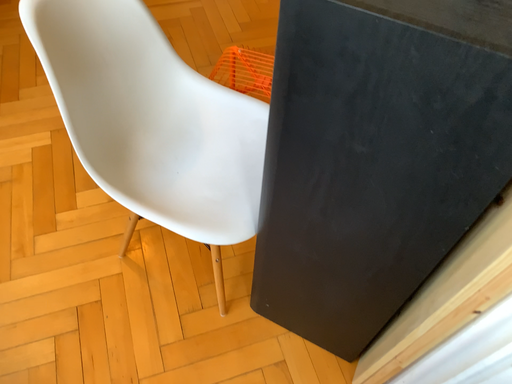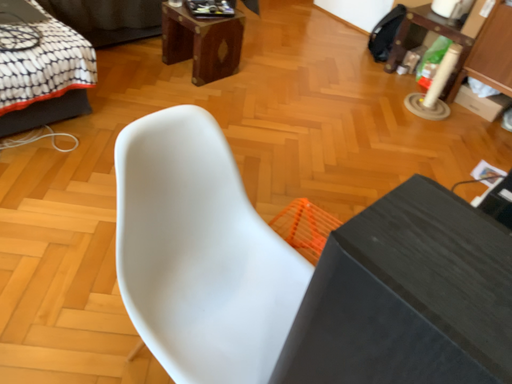
Question: Which way did the camera rotate in the video?

Choices:
 (A) rotated left
 (B) rotated right

Answer: (A)